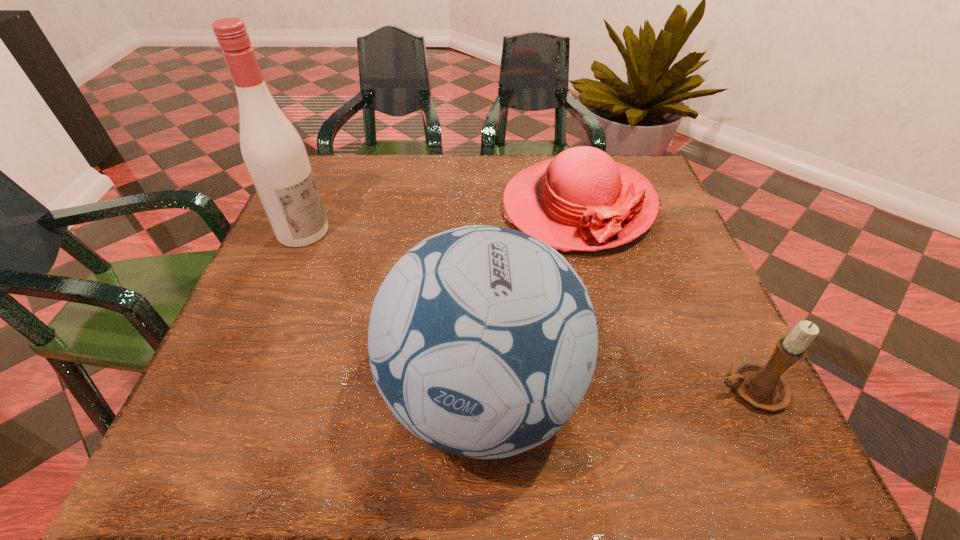
Locate an element on the screen. This screenshot has height=540, width=960. free spot between the shortest object and the tallest object is located at coordinates (441, 219).

In order to click on blank region between the hat and the third tallest object in this screenshot , I will do `click(663, 298)`.

The image size is (960, 540). Identify the location of free space between the alcohol and the hat. (441, 219).

I want to click on unoccupied position between the hat and the tallest object, so click(x=441, y=219).

The height and width of the screenshot is (540, 960). Find the location of `empty location between the second shortest object and the second tallest object`. empty location between the second shortest object and the second tallest object is located at coordinates (616, 392).

Select which object appears as the third closest to the soccer ball. Please provide its 2D coordinates. Your answer should be formatted as a tuple, i.e. [(x, y)], where the tuple contains the x and y coordinates of a point satisfying the conditions above.

[(273, 151)]

Point out which object is positioned as the second nearest to the third shortest object. Please provide its 2D coordinates. Your answer should be formatted as a tuple, i.e. [(x, y)], where the tuple contains the x and y coordinates of a point satisfying the conditions above.

[(761, 385)]

The width and height of the screenshot is (960, 540). In order to click on free space that satisfies the following two spatial constraints: 1. on the back side of the shortest object; 2. on the right side of the alcohol in this screenshot , I will do `click(314, 206)`.

At what (x,y) coordinates should I click in order to perform the action: click on free point that satisfies the following two spatial constraints: 1. on the front side of the second shortest object; 2. on the side of the hat with the handle. Please return your answer as a coordinate pair (x, y). Image resolution: width=960 pixels, height=540 pixels. Looking at the image, I should click on (624, 389).

You are a GUI agent. You are given a task and a screenshot of the screen. Output one action in this format:
    pyautogui.click(x=<x>, y=<y>)
    Task: Click on the free space that satisfies the following two spatial constraints: 1. on the front side of the second shortest object; 2. on the side of the tallest object with the handle
    This screenshot has height=540, width=960.
    Given the screenshot: What is the action you would take?
    pyautogui.click(x=236, y=389)